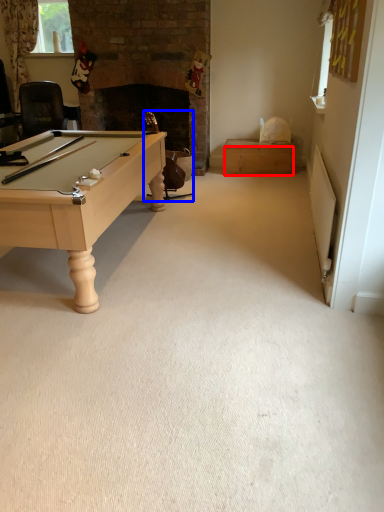
Question: Which object appears farthest to the camera in this image, drawer (highlighted by a red box) or swivel chair (highlighted by a blue box)?

Choices:
 (A) drawer
 (B) swivel chair

Answer: (A)